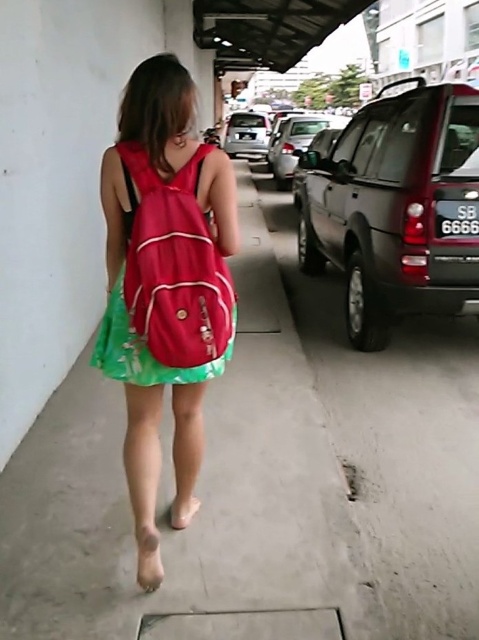
Can you confirm if metallic silver car at center is positioned above silver metallic car at center?

No.

Is metallic silver car at center to the left of silver metallic car at center from the viewer's perspective?

Incorrect, metallic silver car at center is not on the left side of silver metallic car at center.

Is point (278, 148) more distant than point (238, 141)?

No, it is in front of (238, 141).

Locate an element on the screen. This screenshot has width=479, height=640. metallic silver car at center is located at coordinates (296, 141).

Who is more forward, [110,209] or [186,508]?

Point [110,209] is in front.

The height and width of the screenshot is (640, 479). What do you see at coordinates (164, 273) in the screenshot? I see `matte pink backpack at center` at bounding box center [164, 273].

The height and width of the screenshot is (640, 479). Identify the location of matte pink backpack at center. (164, 273).

I want to click on matte pink backpack at center, so click(164, 273).

Is the position of matte pink backpack at center more distant than that of metallic silver car at center?

That is False.

Does matte pink backpack at center lie in front of metallic silver car at center?

Result: Yes, it is.

The image size is (479, 640). Describe the element at coordinates (164, 273) in the screenshot. I see `matte pink backpack at center` at that location.

At what (x,y) coordinates should I click in order to perform the action: click on matte pink backpack at center. Please return your answer as a coordinate pair (x, y). Looking at the image, I should click on (164, 273).